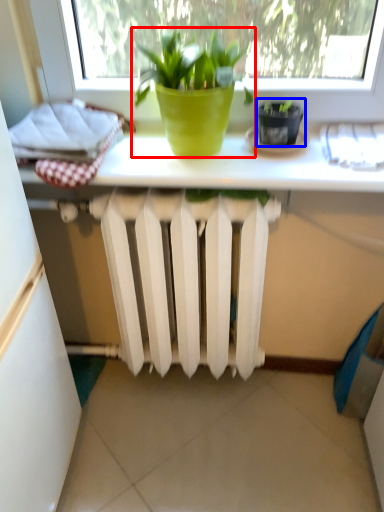
Question: Which object appears farthest to the camera in this image, houseplant (highlighted by a red box) or flowerpot (highlighted by a blue box)?

Choices:
 (A) houseplant
 (B) flowerpot

Answer: (B)